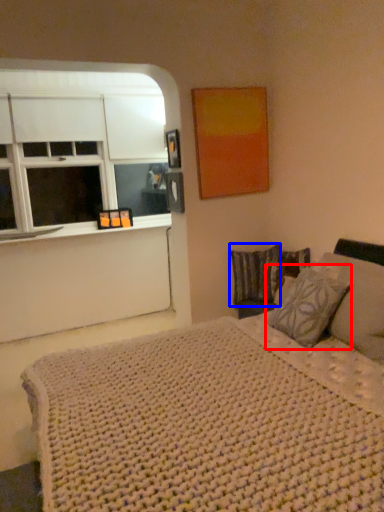
Question: Which object is further to the camera taking this photo, pillow (highlighted by a red box) or pillow (highlighted by a blue box)?

Choices:
 (A) pillow
 (B) pillow

Answer: (B)